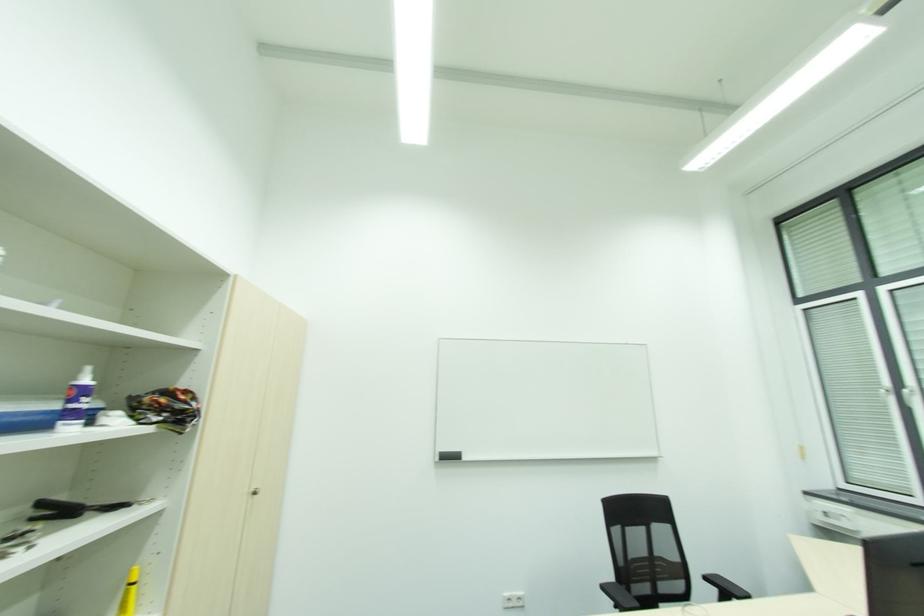
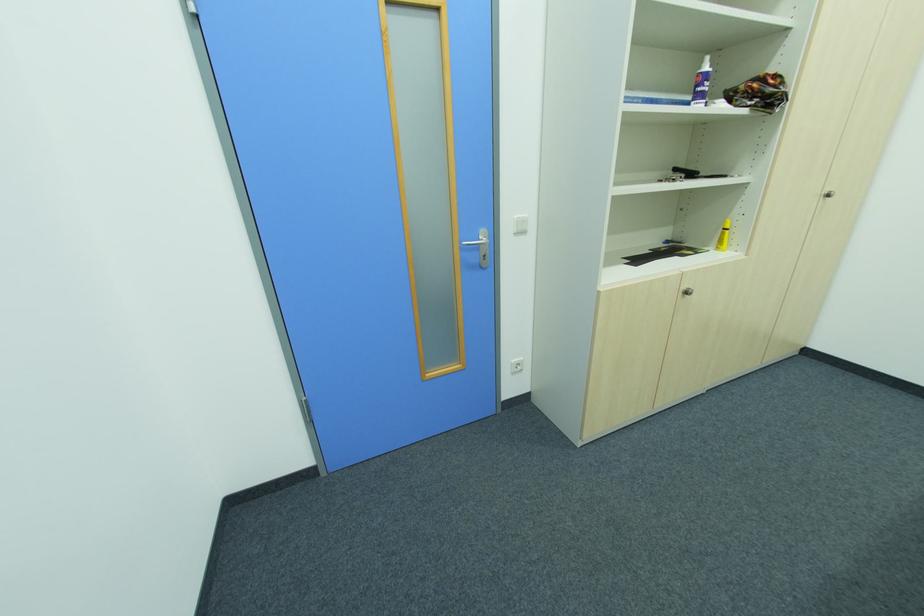
In the second image, find the point that corresponds to point 86,392 in the first image.

(708, 78)